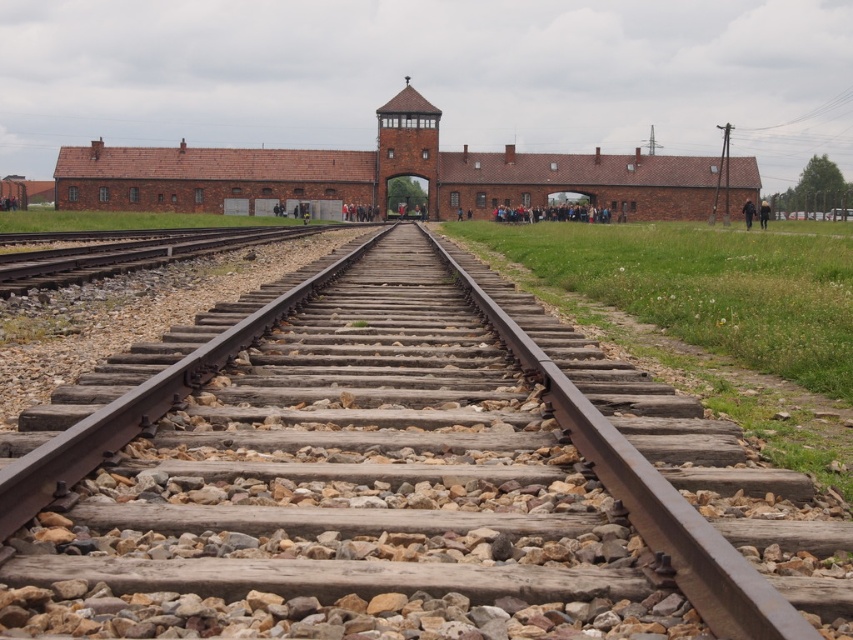
Is point (312, 612) positioned in front of point (759, 211)?

Yes, point (312, 612) is in front of point (759, 211).

Which is in front, point (252, 292) or point (764, 218)?

Point (252, 292) is in front.

The image size is (853, 640). What are the coordinates of `brown wooden track at center` in the screenshot? It's located at (399, 480).

The width and height of the screenshot is (853, 640). Find the location of `brown wooden track at center`. brown wooden track at center is located at coordinates (399, 480).

Can you confirm if black fabric jacket at center is smaller than black leather jacket at center?

No.

What do you see at coordinates (747, 212) in the screenshot? The height and width of the screenshot is (640, 853). I see `black fabric jacket at center` at bounding box center [747, 212].

This screenshot has height=640, width=853. I want to click on black fabric jacket at center, so click(747, 212).

Find the location of `black fabric jacket at center`. black fabric jacket at center is located at coordinates (747, 212).

Does brown wooden track at center have a lesser height compared to brown brick building at center?

Yes.

Describe the element at coordinates (399, 480) in the screenshot. Image resolution: width=853 pixels, height=640 pixels. I see `brown wooden track at center` at that location.

The width and height of the screenshot is (853, 640). I want to click on brown wooden track at center, so click(399, 480).